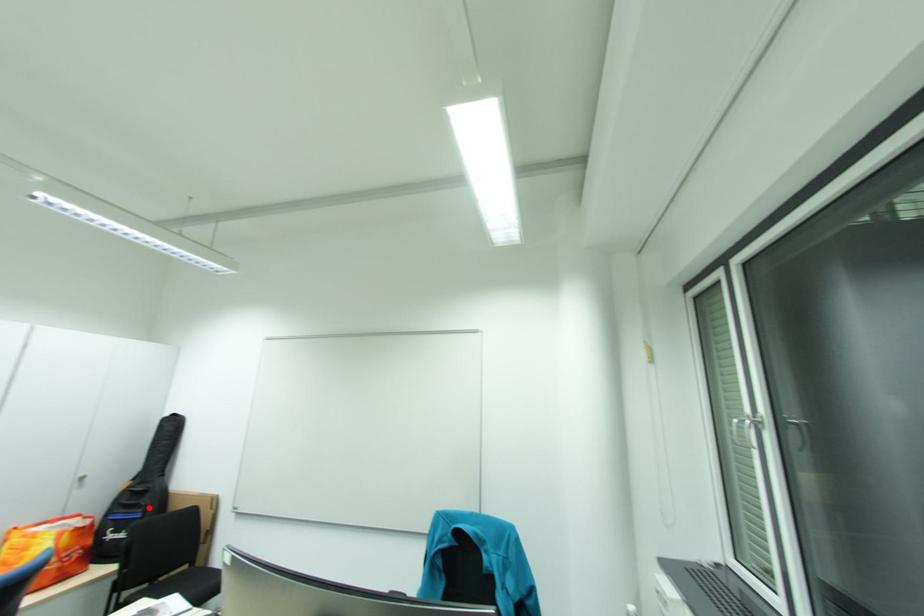
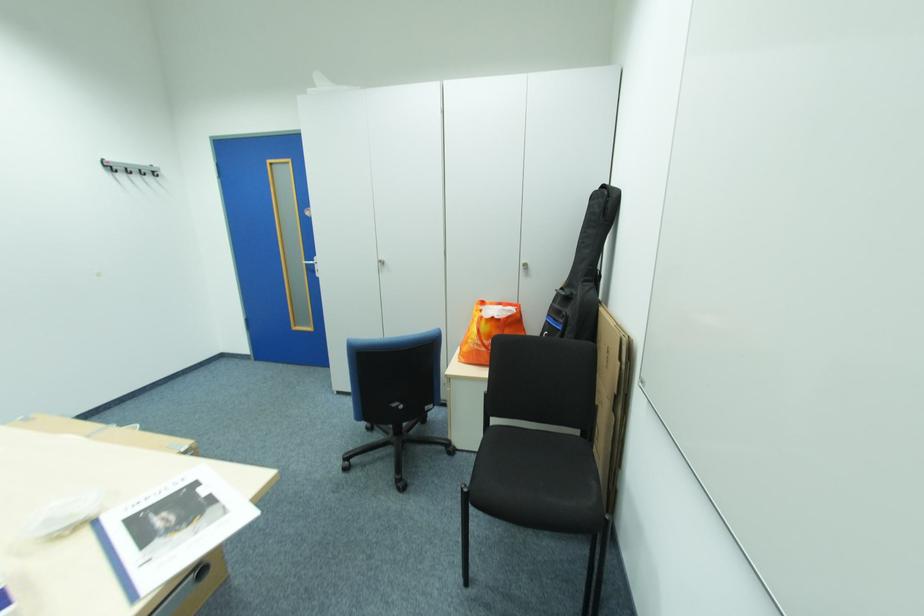
Question: I am providing you with two images of the same scene from different viewpoints. Image1 has a red point marked. In image2, the corresponding 3D location appears at what relative position? Reply with the corresponding letter.

Choices:
 (A) Closer
 (B) Farther

Answer: (B)